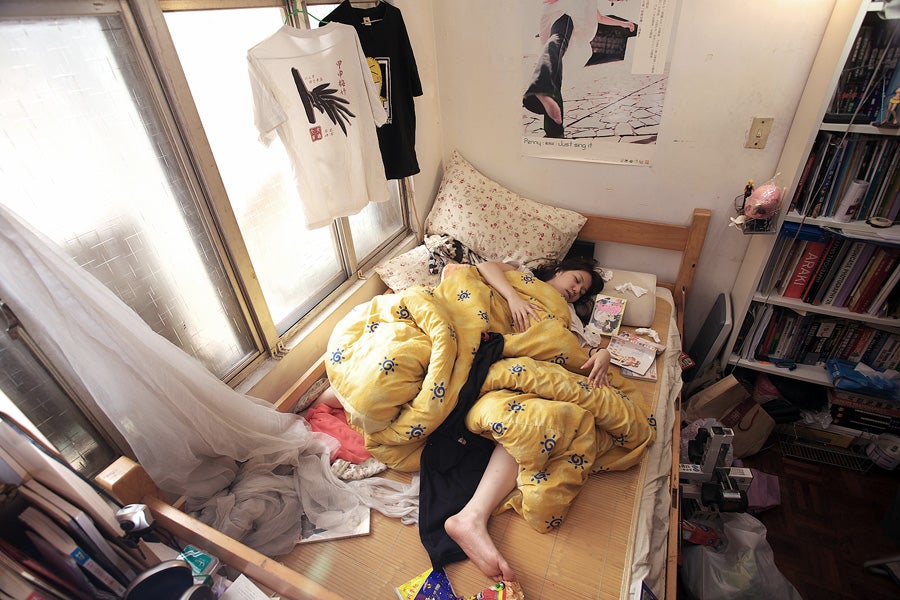
The image size is (900, 600). I want to click on hardwood floor, so click(838, 546).